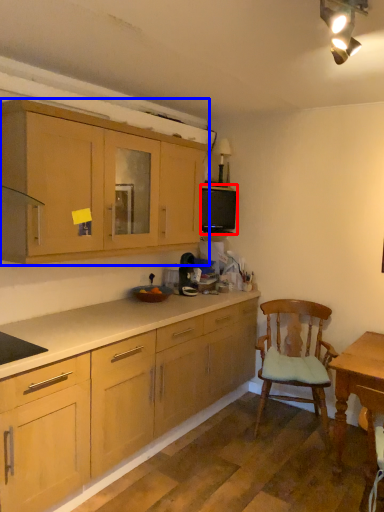
Question: Which point is closer to the camera, appliance (highlighted by a red box) or cabinetry (highlighted by a blue box)?

Choices:
 (A) appliance
 (B) cabinetry

Answer: (B)